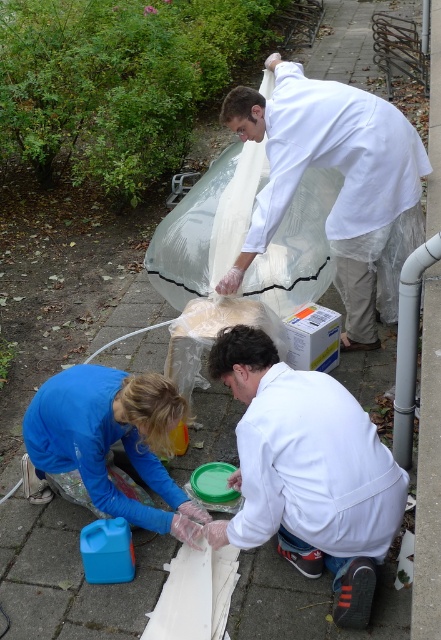
You are a photographer trying to capture a clear shot of both the white matte coat at upper center and the blue fabric gloves at lower center. Which object should you focus on first to ensure both are in focus?

You should focus on the white matte coat at upper center first because it is closer to you than the blue fabric gloves at lower center, so focusing on the closer object first will help ensure both are in focus.